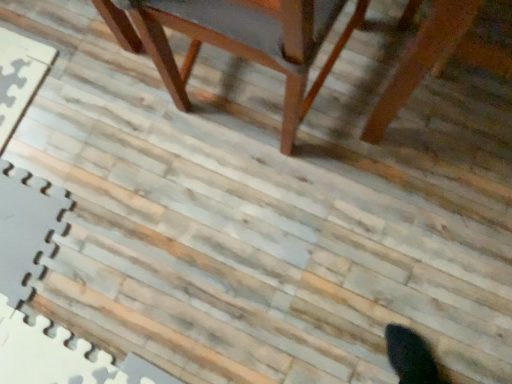
I want to click on wooden chair at upper center, so click(233, 40).

The image size is (512, 384). Describe the element at coordinates (233, 40) in the screenshot. I see `wooden chair at upper center` at that location.

Where is `wooden chair at upper center`? This screenshot has height=384, width=512. wooden chair at upper center is located at coordinates (233, 40).